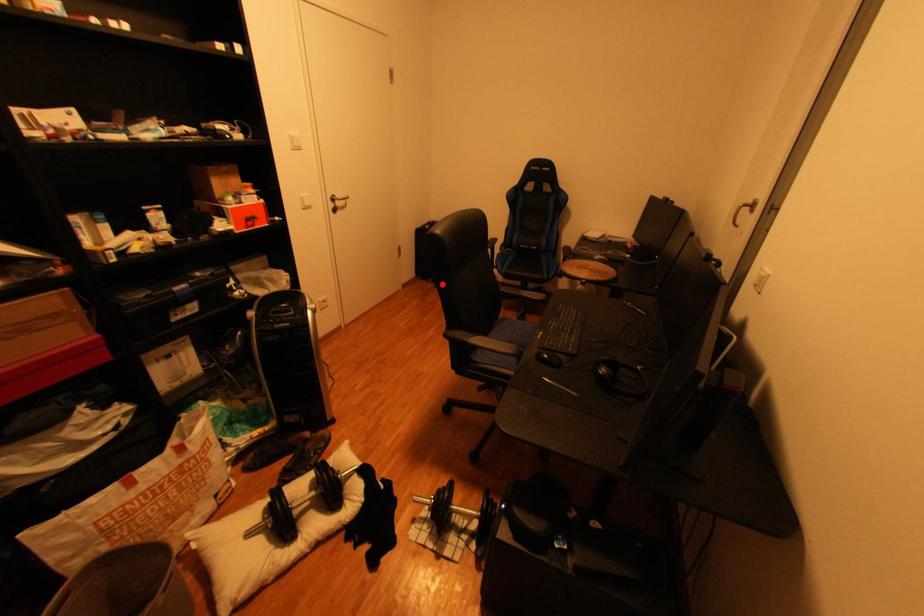
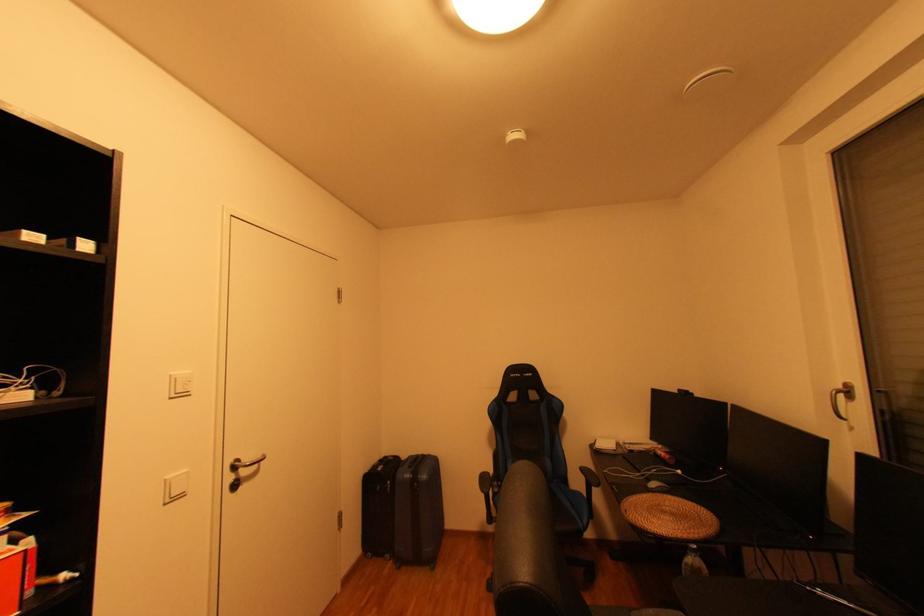
The point at the highlighted location is marked in the first image. Where is the corresponding point in the second image?

(400, 562)